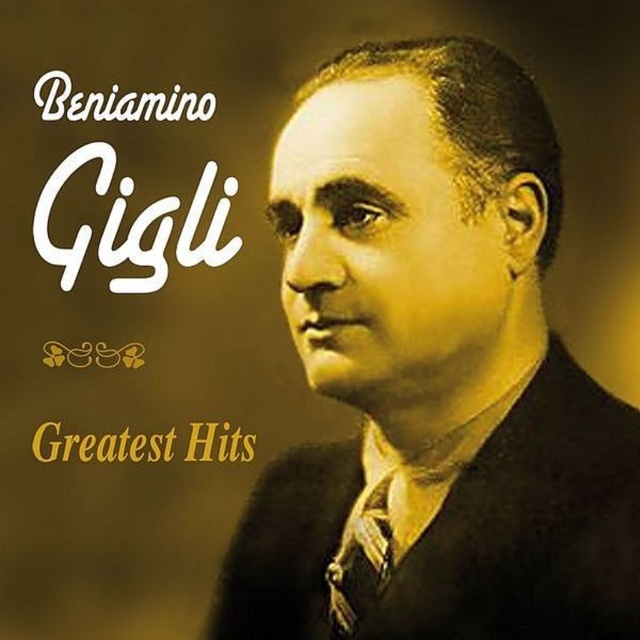
Question: Which of the following is the farthest from the observer?

Choices:
 (A) (490, 492)
 (B) (333, 579)

Answer: (B)

Question: Can you confirm if black wool business suit at center is positioned to the left of white paper text at upper left?

Choices:
 (A) no
 (B) yes

Answer: (A)

Question: Is black wool business suit at center positioned in front of matte black tie at center?

Choices:
 (A) yes
 (B) no

Answer: (A)

Question: Is black wool business suit at center positioned behind matte black tie at center?

Choices:
 (A) yes
 (B) no

Answer: (B)

Question: Which point is farther to the camera?

Choices:
 (A) (96, 157)
 (B) (392, 324)
 (C) (349, 454)
 (D) (340, 625)

Answer: (A)

Question: Based on their relative distances, which object is farther from the matte black tie at center?

Choices:
 (A) black wool business suit at center
 (B) white paper text at upper left

Answer: (B)